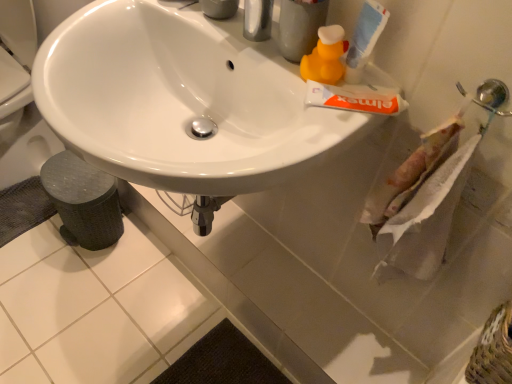
Question: Can you confirm if textured woven basket at lower right is smaller than white matte tube of toothpaste at upper right, acting as the 2th toothpaste starting from the bottom?

Choices:
 (A) no
 (B) yes

Answer: (A)

Question: From a real-world perspective, is textured woven basket at lower right physically above white matte tube of toothpaste at upper right, which is counted as the 1th toothpaste, starting from the top?

Choices:
 (A) yes
 (B) no

Answer: (B)

Question: Can you confirm if textured woven basket at lower right is positioned to the right of white matte tube of toothpaste at upper right, which is counted as the 1th toothpaste, starting from the top?

Choices:
 (A) yes
 (B) no

Answer: (A)

Question: Would you say textured woven basket at lower right contains white matte tube of toothpaste at upper right, which is counted as the 1th toothpaste, starting from the top?

Choices:
 (A) yes
 (B) no

Answer: (B)

Question: Is textured woven basket at lower right not inside white matte tube of toothpaste at upper right, acting as the 2th toothpaste starting from the bottom?

Choices:
 (A) no
 (B) yes

Answer: (B)

Question: Is textured woven basket at lower right behind white matte tube of toothpaste at upper right, acting as the 2th toothpaste starting from the bottom?

Choices:
 (A) no
 (B) yes

Answer: (A)

Question: From a real-world perspective, is white paper towel at right physically below textured woven basket at lower right?

Choices:
 (A) yes
 (B) no

Answer: (B)

Question: Is white paper towel at right shorter than textured woven basket at lower right?

Choices:
 (A) yes
 (B) no

Answer: (B)

Question: Considering the relative positions of white paper towel at right and textured woven basket at lower right in the image provided, is white paper towel at right to the left of textured woven basket at lower right from the viewer's perspective?

Choices:
 (A) no
 (B) yes

Answer: (B)

Question: Is white paper towel at right in front of textured woven basket at lower right?

Choices:
 (A) no
 (B) yes

Answer: (A)

Question: From the image's perspective, is white paper towel at right located beneath textured woven basket at lower right?

Choices:
 (A) no
 (B) yes

Answer: (A)

Question: Considering the relative sizes of white paper towel at right and textured woven basket at lower right in the image provided, is white paper towel at right bigger than textured woven basket at lower right?

Choices:
 (A) no
 (B) yes

Answer: (A)

Question: Would you say white matte tube of toothpaste at upper right, which is counted as the first toothpaste, starting from the bottom, contains white glossy sink at center?

Choices:
 (A) yes
 (B) no

Answer: (B)